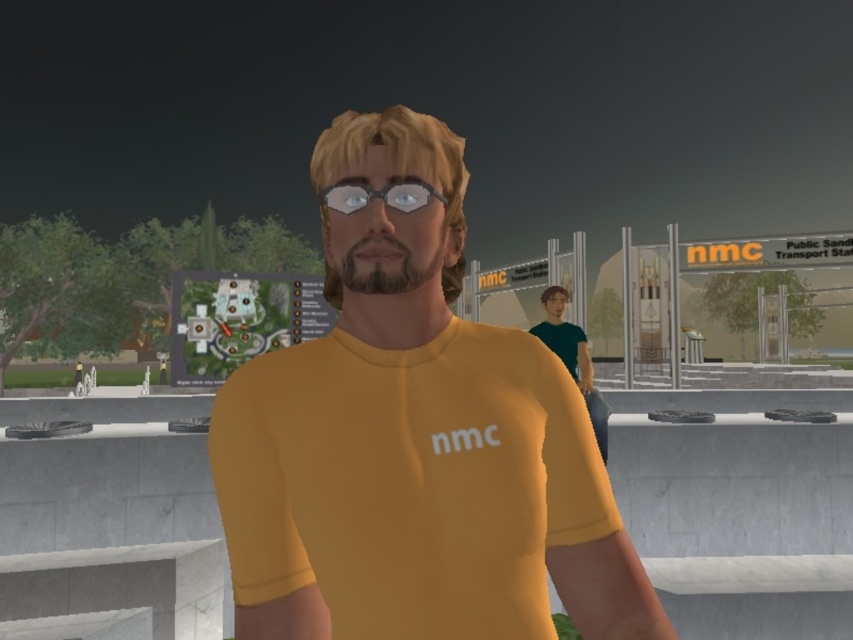
Is point (222, 522) positioned in front of point (349, 188)?

No, it is behind (349, 188).

Between yellow matte shirt at center and transparent plastic goggles at center, which one appears on the right side from the viewer's perspective?

Positioned to the right is yellow matte shirt at center.

Identify the location of yellow matte shirt at center. Image resolution: width=853 pixels, height=640 pixels. (415, 442).

Where is `yellow matte shirt at center`? The height and width of the screenshot is (640, 853). yellow matte shirt at center is located at coordinates (415, 442).